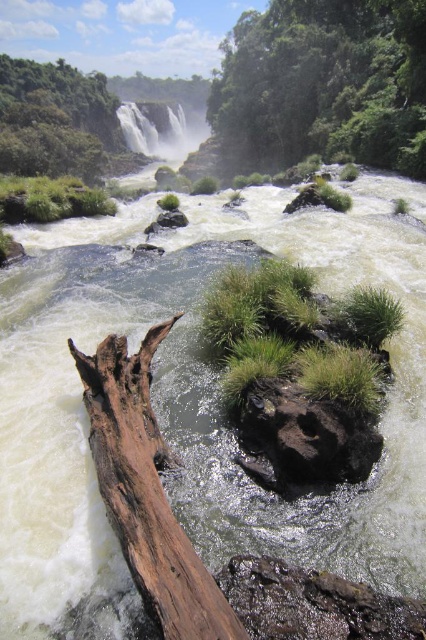
Question: Can you confirm if black rough rock at center is positioned to the right of white textured water at upper center?

Choices:
 (A) no
 (B) yes

Answer: (B)

Question: Which object is the farthest from the green leafy tree at upper left?

Choices:
 (A) brown rough tree trunk at lower left
 (B) green grassy at center
 (C) green leafy tree at upper center
 (D) black rough rock at center

Answer: (A)

Question: Which point appears closest to the camera in this image?

Choices:
 (A) (328, 154)
 (B) (46, 113)

Answer: (A)

Question: Does green grassy at center appear on the right side of white textured water at upper center?

Choices:
 (A) no
 (B) yes

Answer: (B)

Question: Does green leafy tree at upper left have a larger size compared to white textured water at upper center?

Choices:
 (A) no
 (B) yes

Answer: (B)

Question: Which point is farther to the camera?

Choices:
 (A) (126, 124)
 (B) (356, 364)

Answer: (A)